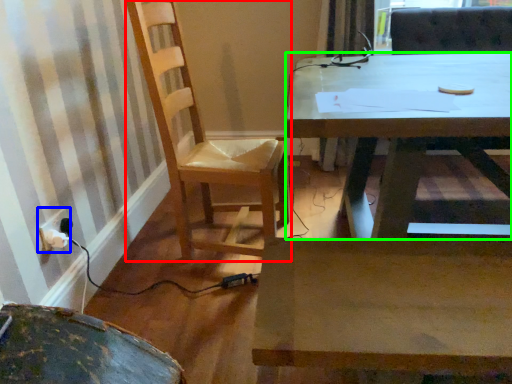
Question: Which object is positioned farthest from chair (highlighted by a red box)? Select from electric outlet (highlighted by a blue box) and desk (highlighted by a green box).

Choices:
 (A) electric outlet
 (B) desk

Answer: (A)